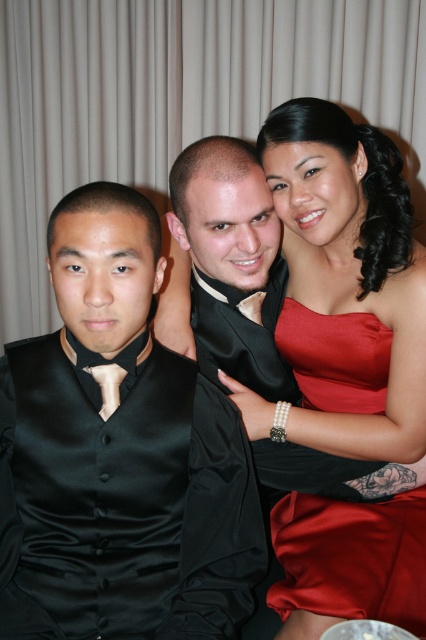
Question: Which point is closer to the camera?

Choices:
 (A) (115, 378)
 (B) (29, 385)
 (C) (354, 390)

Answer: (B)

Question: Which point is closer to the camera?

Choices:
 (A) (166, 387)
 (B) (101, 369)
 (C) (380, 358)

Answer: (B)

Question: Is shiny satin dress at upper right thinner than matte black tie at left?

Choices:
 (A) no
 (B) yes

Answer: (A)

Question: Can you confirm if shiny satin dress at upper right is bigger than matte black tie at left?

Choices:
 (A) yes
 (B) no

Answer: (A)

Question: Can you confirm if black satin vest at left is positioned below matte black tie at left?

Choices:
 (A) yes
 (B) no

Answer: (A)

Question: Among these objects, which one is farthest from the camera?

Choices:
 (A) black satin vest at left
 (B) shiny satin dress at upper right

Answer: (B)